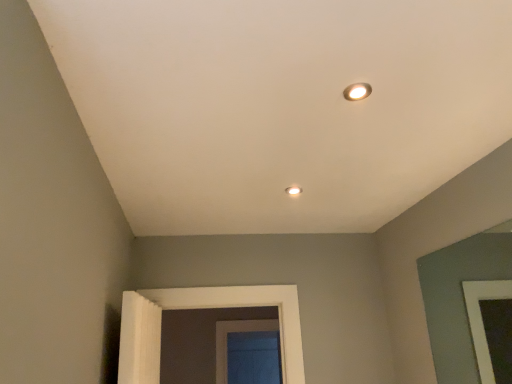
Question: Can you confirm if matte white recessed light at upper right is thinner than matte white lamp at upper center?

Choices:
 (A) no
 (B) yes

Answer: (B)

Question: Is matte white recessed light at upper right turned away from matte white lamp at upper center?

Choices:
 (A) no
 (B) yes

Answer: (B)

Question: Is matte white recessed light at upper right further to camera compared to matte white lamp at upper center?

Choices:
 (A) yes
 (B) no

Answer: (B)

Question: From a real-world perspective, is matte white recessed light at upper right located beneath matte white lamp at upper center?

Choices:
 (A) no
 (B) yes

Answer: (A)

Question: Is matte white recessed light at upper right directly adjacent to matte white lamp at upper center?

Choices:
 (A) no
 (B) yes

Answer: (A)

Question: Considering the relative sizes of matte white recessed light at upper right and matte white lamp at upper center in the image provided, is matte white recessed light at upper right shorter than matte white lamp at upper center?

Choices:
 (A) yes
 (B) no

Answer: (B)

Question: Can you confirm if matte white lamp at upper center is positioned to the left of matte white recessed light at upper right?

Choices:
 (A) no
 (B) yes

Answer: (B)

Question: Is matte white lamp at upper center located outside matte white recessed light at upper right?

Choices:
 (A) yes
 (B) no

Answer: (A)

Question: Does matte white lamp at upper center have a greater width compared to matte white recessed light at upper right?

Choices:
 (A) no
 (B) yes

Answer: (B)

Question: Considering the relative sizes of matte white lamp at upper center and matte white recessed light at upper right in the image provided, is matte white lamp at upper center shorter than matte white recessed light at upper right?

Choices:
 (A) yes
 (B) no

Answer: (A)

Question: Is matte white lamp at upper center beside matte white recessed light at upper right?

Choices:
 (A) yes
 (B) no

Answer: (B)

Question: Can you confirm if matte white lamp at upper center is bigger than matte white recessed light at upper right?

Choices:
 (A) no
 (B) yes

Answer: (A)

Question: Based on their positions, is matte white recessed light at upper right located to the left or right of matte white lamp at upper center?

Choices:
 (A) left
 (B) right

Answer: (B)